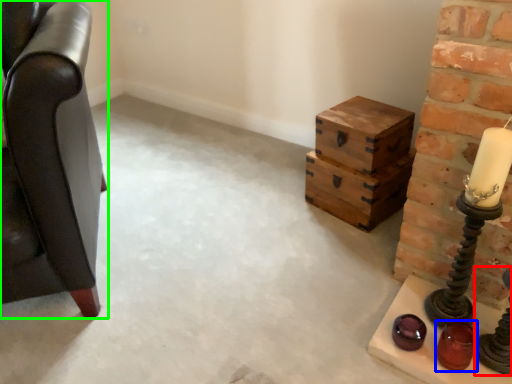
Question: Based on their relative distances, which object is farther from candle holder (highlighted by a red box)? Choose from candle holder (highlighted by a blue box) and furniture (highlighted by a green box).

Choices:
 (A) candle holder
 (B) furniture

Answer: (B)